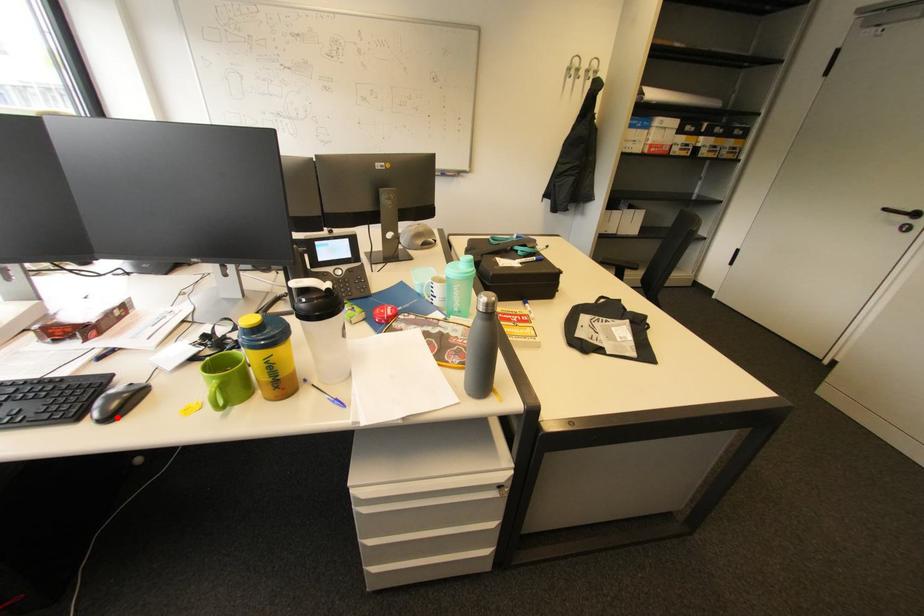
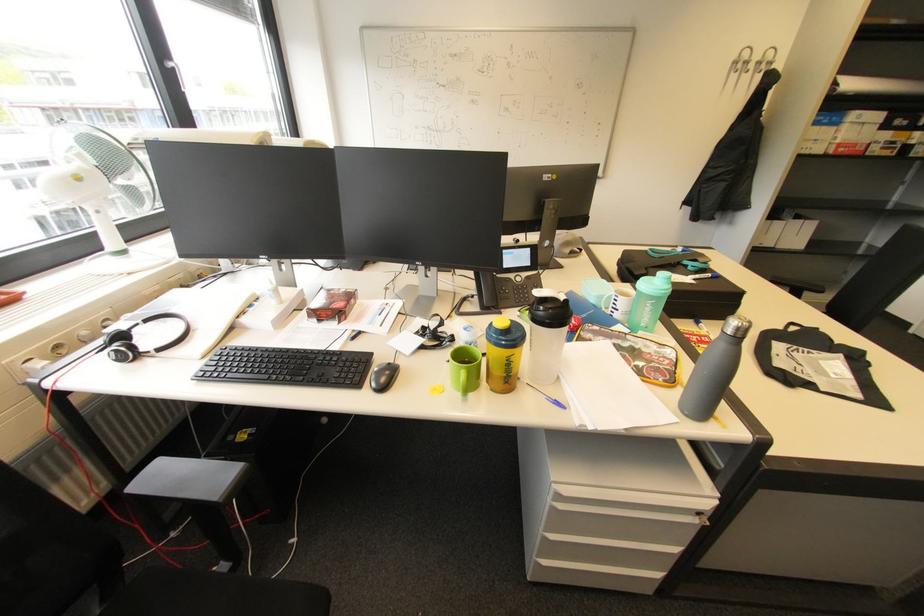
Where in the second image is the point corresponding to the highlighted location from the first image?

(387, 389)